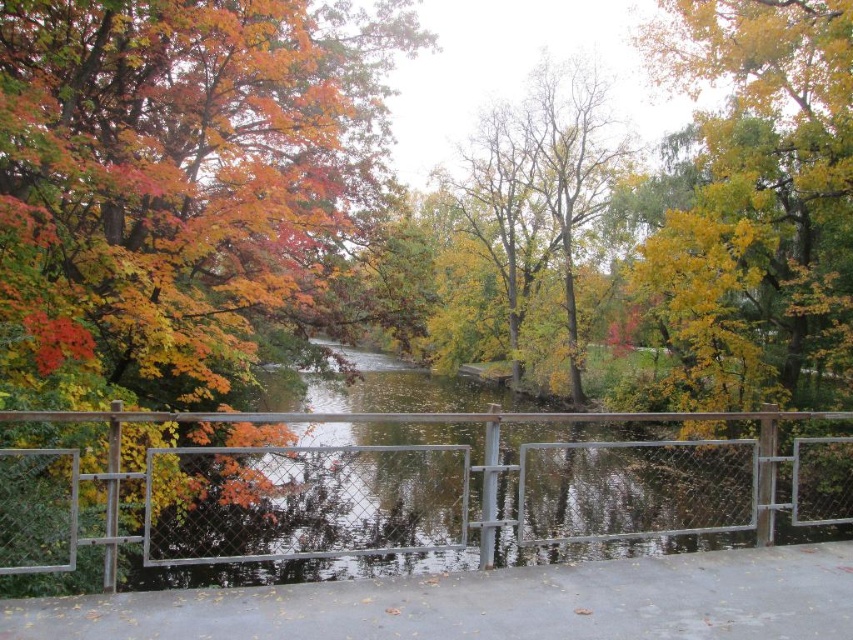
You are standing at the edge of the river and want to reach a specific point marked as point (300, 490). The metal railing in front of you is 15 feet long. Can you walk along the railing to reach that point?

The point (300, 490) is 17.67 feet from the viewer, which is farther than the 15 feet length of the railing. Therefore, you cannot reach the point by walking along the railing.